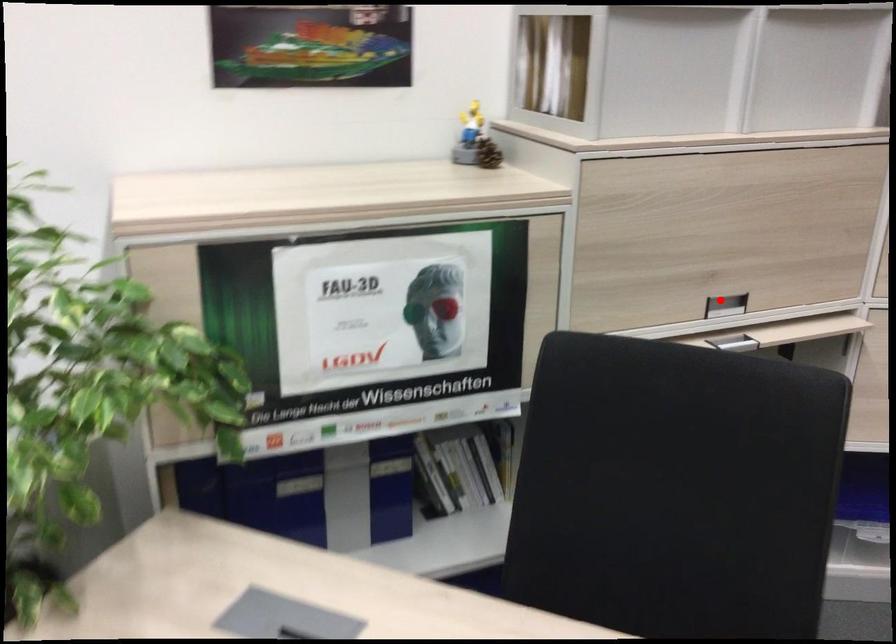
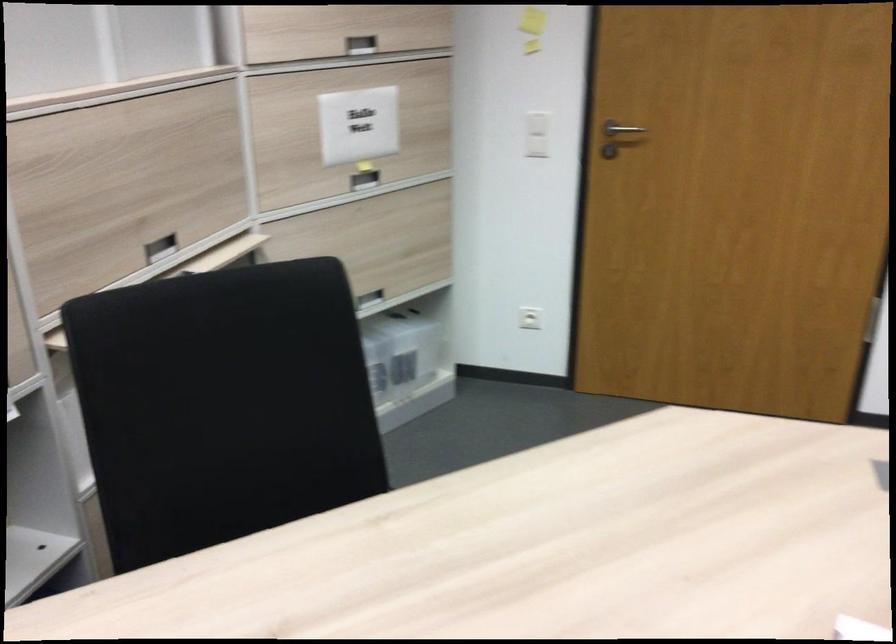
In the second image, find the point that corresponds to the highlighted location in the first image.

(159, 247)